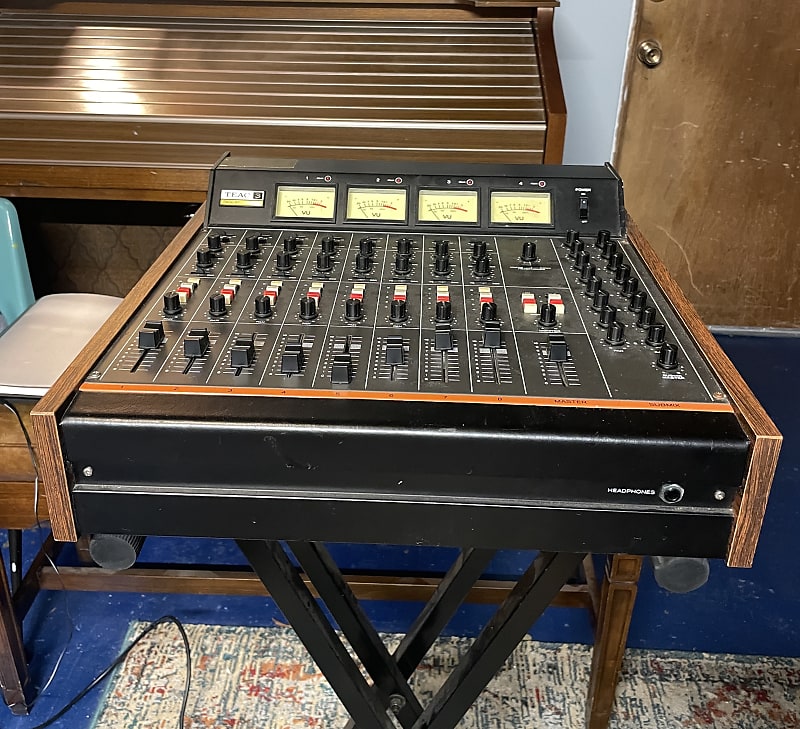
Where is `four small light green screens`? The height and width of the screenshot is (729, 800). four small light green screens is located at coordinates (305, 189), (386, 206), (462, 197), (516, 197).